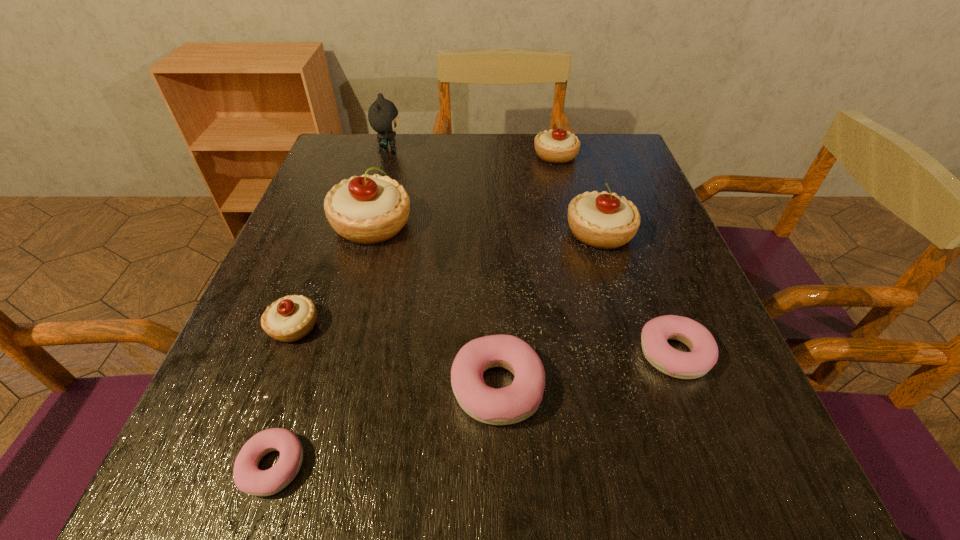
Where is `gray kitten`? The width and height of the screenshot is (960, 540). gray kitten is located at coordinates (383, 117).

At what (x,y) coordinates should I click in order to perform the action: click on the biggest beige pastry. Please return your answer as a coordinate pair (x, y). Looking at the image, I should click on (367, 209).

Image resolution: width=960 pixels, height=540 pixels. I want to click on the sixth shortest pastry, so click(x=601, y=220).

Locate an element on the screen. Image resolution: width=960 pixels, height=540 pixels. the sixth shortest object is located at coordinates (601, 220).

Find the location of a particular element. The width and height of the screenshot is (960, 540). the fourth tallest object is located at coordinates (558, 146).

At what (x,y) coordinates should I click in order to perform the action: click on the second smallest beige pastry. Please return your answer as a coordinate pair (x, y). Image resolution: width=960 pixels, height=540 pixels. Looking at the image, I should click on (558, 146).

Find the location of `the nearest beige pastry`. the nearest beige pastry is located at coordinates (290, 318).

The image size is (960, 540). In order to click on the fourth shortest pastry in this screenshot , I will do `click(290, 318)`.

The image size is (960, 540). What are the coordinates of `the sixth tallest object` in the screenshot? It's located at (512, 404).

Locate an element on the screen. This screenshot has height=540, width=960. the biggest pink pastry is located at coordinates (512, 404).